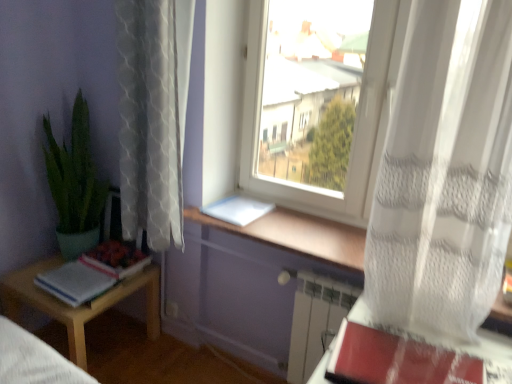
Question: Considering the relative sizes of red matte paperback book at lower right, the first paperback book from the right, and white sheer curtain at right, which is the 1th curtain from right to left, in the image provided, is red matte paperback book at lower right, the first paperback book from the right, bigger than white sheer curtain at right, which is the 1th curtain from right to left,?

Choices:
 (A) no
 (B) yes

Answer: (A)

Question: From the image's perspective, is red matte paperback book at lower right, which is the second paperback book in top-to-bottom order, under white sheer curtain at right, the 2th curtain viewed from the left?

Choices:
 (A) yes
 (B) no

Answer: (A)

Question: From a real-world perspective, is red matte paperback book at lower right, the 1th paperback book positioned from the front, on white sheer curtain at right, which is the 1th curtain from right to left?

Choices:
 (A) no
 (B) yes

Answer: (A)

Question: Does red matte paperback book at lower right, which is the second paperback book in back-to-front order, lie behind white sheer curtain at right, the 2th curtain viewed from the left?

Choices:
 (A) no
 (B) yes

Answer: (A)

Question: Considering the relative sizes of red matte paperback book at lower right, the 1th paperback book positioned from the front, and white sheer curtain at right, which is the 1th curtain from right to left, in the image provided, is red matte paperback book at lower right, the 1th paperback book positioned from the front, wider than white sheer curtain at right, which is the 1th curtain from right to left,?

Choices:
 (A) no
 (B) yes

Answer: (B)

Question: Can white sheer curtain at right, which is the 1th curtain from right to left, be found inside red matte paperback book at lower right, which is the second paperback book in back-to-front order?

Choices:
 (A) no
 (B) yes

Answer: (A)

Question: From a real-world perspective, is green matte plant at left beneath white lace curtain at left, placed as the 1th curtain when sorted from left to right?

Choices:
 (A) yes
 (B) no

Answer: (A)

Question: Does green matte plant at left have a greater height compared to white lace curtain at left, placed as the 1th curtain when sorted from left to right?

Choices:
 (A) no
 (B) yes

Answer: (A)

Question: Considering the relative positions of green matte plant at left and white lace curtain at left, placed as the 2th curtain when sorted from right to left, in the image provided, is green matte plant at left in front of white lace curtain at left, placed as the 2th curtain when sorted from right to left,?

Choices:
 (A) no
 (B) yes

Answer: (A)

Question: Is white lace curtain at left, placed as the 1th curtain when sorted from left to right, surrounded by green matte plant at left?

Choices:
 (A) yes
 (B) no

Answer: (B)

Question: Is green matte plant at left far away from white lace curtain at left, placed as the 2th curtain when sorted from right to left?

Choices:
 (A) yes
 (B) no

Answer: (B)

Question: Is green matte plant at left aimed at white lace curtain at left, placed as the 2th curtain when sorted from right to left?

Choices:
 (A) yes
 (B) no

Answer: (B)

Question: Does white plastic window at center have a greater width compared to red matte paperback book at lower right, which is the second paperback book in back-to-front order?

Choices:
 (A) yes
 (B) no

Answer: (B)